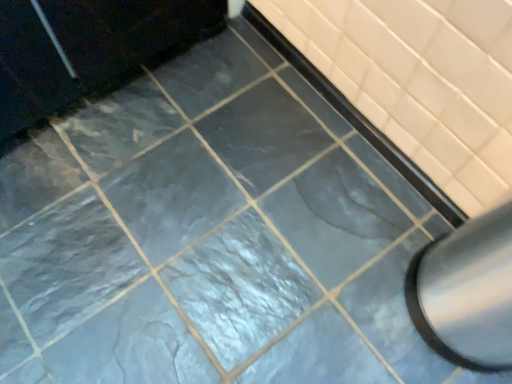
Question: Is matte black bathtub at center next to satin silver exhaust hood at lower right and touching it?

Choices:
 (A) yes
 (B) no

Answer: (B)

Question: Could satin silver exhaust hood at lower right be considered to be inside matte black bathtub at center?

Choices:
 (A) no
 (B) yes

Answer: (A)

Question: Does matte black bathtub at center appear on the right side of satin silver exhaust hood at lower right?

Choices:
 (A) yes
 (B) no

Answer: (B)

Question: From a real-world perspective, is matte black bathtub at center beneath satin silver exhaust hood at lower right?

Choices:
 (A) no
 (B) yes

Answer: (B)

Question: Is matte black bathtub at center at the left side of satin silver exhaust hood at lower right?

Choices:
 (A) no
 (B) yes

Answer: (B)

Question: From a real-world perspective, is matte black bathtub at center over satin silver exhaust hood at lower right?

Choices:
 (A) no
 (B) yes

Answer: (A)

Question: Is satin silver exhaust hood at lower right further to camera compared to matte black bathtub at center?

Choices:
 (A) no
 (B) yes

Answer: (A)

Question: Is satin silver exhaust hood at lower right positioned before matte black bathtub at center?

Choices:
 (A) no
 (B) yes

Answer: (B)

Question: Could you tell me if satin silver exhaust hood at lower right is facing matte black bathtub at center?

Choices:
 (A) yes
 (B) no

Answer: (B)

Question: Is satin silver exhaust hood at lower right next to matte black bathtub at center?

Choices:
 (A) yes
 (B) no

Answer: (B)

Question: From a real-world perspective, is satin silver exhaust hood at lower right positioned under matte black bathtub at center based on gravity?

Choices:
 (A) no
 (B) yes

Answer: (A)

Question: From the image's perspective, does satin silver exhaust hood at lower right appear lower than matte black bathtub at center?

Choices:
 (A) no
 (B) yes

Answer: (B)

Question: From the image's perspective, relative to satin silver exhaust hood at lower right, is matte black bathtub at center above or below?

Choices:
 (A) below
 (B) above

Answer: (B)